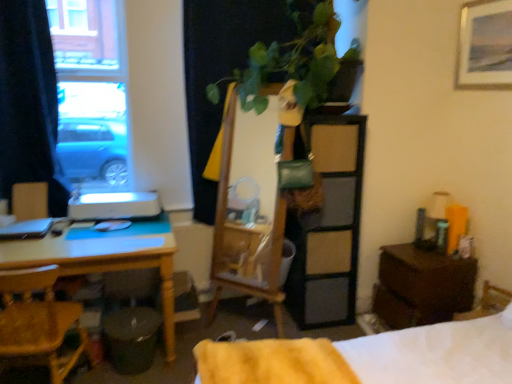
Identify the location of blank space situated above brown matte nightstand at lower right (from a real-world perspective). (431, 254).